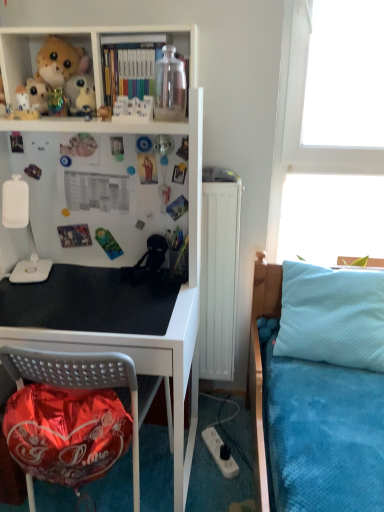
You are a GUI agent. You are given a task and a screenshot of the screen. Output one action in this format:
    pyautogui.click(x=<x>, y=<y>)
    Task: Click on the white plastic power outlet at lower center
    This screenshot has width=384, height=512.
    Given the screenshot: What is the action you would take?
    pyautogui.click(x=219, y=453)

Describe the element at coordinates (20, 228) in the screenshot. This screenshot has width=384, height=512. I see `white plastic lamp at left` at that location.

The height and width of the screenshot is (512, 384). Describe the element at coordinates (104, 112) in the screenshot. I see `matte plastic toy at upper center, placed as the first toy when sorted from front to back` at that location.

Describe the element at coordinates (96, 174) in the screenshot. I see `black matte desk at center` at that location.

What do you see at coordinates (170, 87) in the screenshot? The width and height of the screenshot is (384, 512). I see `transparent glass jar at upper center` at bounding box center [170, 87].

Describe the element at coordinates (116, 334) in the screenshot. The width and height of the screenshot is (384, 512). I see `metallic black desk at lower left` at that location.

The image size is (384, 512). I want to click on white plastic power outlet at lower center, so click(x=219, y=453).

Measure the distance from white plush toy at upper left, which ranks as the third toy in front-to-back order, to white plastic power outlet at lower center.

white plush toy at upper left, which ranks as the third toy in front-to-back order, and white plastic power outlet at lower center are 4.89 feet apart from each other.

From a real-world perspective, is white plush toy at upper left, which ranks as the third toy in front-to-back order, positioned above or below white plastic power outlet at lower center?

white plush toy at upper left, which ranks as the third toy in front-to-back order, is above white plastic power outlet at lower center.

Which is more to the left, white plush toy at upper left, placed as the 1th toy when sorted from left to right, or white plastic power outlet at lower center?

Positioned to the left is white plush toy at upper left, placed as the 1th toy when sorted from left to right.

Is white plush toy at upper left, acting as the 1th toy starting from the back, located outside white plastic power outlet at lower center?

Indeed, white plush toy at upper left, acting as the 1th toy starting from the back, is completely outside white plastic power outlet at lower center.

Is white plastic lamp at left inside the boundaries of transparent glass jar at upper center, or outside?

white plastic lamp at left lies outside transparent glass jar at upper center.

Considering the relative sizes of white plastic lamp at left and transparent glass jar at upper center in the image provided, is white plastic lamp at left smaller than transparent glass jar at upper center?

Actually, white plastic lamp at left might be larger than transparent glass jar at upper center.

From the image's perspective, is white plastic lamp at left beneath transparent glass jar at upper center?

Indeed, from the image's perspective, white plastic lamp at left is shown beneath transparent glass jar at upper center.

Identify the location of lamp below the transparent glass jar at upper center (from a real-world perspective). (20, 228).

Image resolution: width=384 pixels, height=512 pixels. In order to click on the 1st toy behind the light blue quilted pillow at right in this screenshot , I will do `click(24, 106)`.

From the image's perspective, is white matte plush toy at upper left, which is counted as the second toy, starting from the right, located above or below light blue quilted pillow at right?

Clearly, from the image's perspective, white matte plush toy at upper left, which is counted as the second toy, starting from the right, is above light blue quilted pillow at right.

From a real-world perspective, which object stands above the other?

white matte plush toy at upper left, which is counted as the second toy, starting from the back.

Is white matte plush toy at upper left, which is counted as the 2th toy, starting from the left, completely or partially outside of light blue quilted pillow at right?

Indeed, white matte plush toy at upper left, which is counted as the 2th toy, starting from the left, is completely outside light blue quilted pillow at right.

Can you see white plastic lamp at left touching transparent glass window at upper right?

white plastic lamp at left and transparent glass window at upper right are not in contact.

Is white plastic lamp at left oriented towards transparent glass window at upper right?

No, white plastic lamp at left is not turned towards transparent glass window at upper right.

Could transparent glass window at upper right be considered to be inside white plastic lamp at left?

No, transparent glass window at upper right is located outside of white plastic lamp at left.

From a real-world perspective, relative to transparent glass window at upper right, is white plastic lamp at left vertically above or below?

From a real-world perspective, white plastic lamp at left is physically below transparent glass window at upper right.

Looking at the image, does black matte desk at center seem bigger or smaller compared to fluffy brown teddy bear at upper left?

black matte desk at center is bigger than fluffy brown teddy bear at upper left.

Does black matte desk at center turn towards fluffy brown teddy bear at upper left?

No, black matte desk at center is not oriented towards fluffy brown teddy bear at upper left.

From a real-world perspective, is black matte desk at center under fluffy brown teddy bear at upper left?

Yes, from a real-world perspective, black matte desk at center is under fluffy brown teddy bear at upper left.

Which of these two, black matte desk at center or fluffy brown teddy bear at upper left, stands taller?

Standing taller between the two is black matte desk at center.

The image size is (384, 512). There is a fluffy brown teddy bear at upper left. Find the location of `the 3rd toy below it (from a real-world perspective)`. the 3rd toy below it (from a real-world perspective) is located at coordinates (104, 112).

From the image's perspective, which is above, matte plastic toy at upper center, which is the first toy from right to left, or fluffy brown teddy bear at upper left?

fluffy brown teddy bear at upper left.

From a real-world perspective, is matte plastic toy at upper center, which is the 3th toy from left to right, positioned over fluffy brown teddy bear at upper left based on gravity?

No, from a real-world perspective, matte plastic toy at upper center, which is the 3th toy from left to right, is not above fluffy brown teddy bear at upper left.

Is matte plastic toy at upper center, marked as the third toy in a back-to-front arrangement, directly adjacent to fluffy brown teddy bear at upper left?

matte plastic toy at upper center, marked as the third toy in a back-to-front arrangement, and fluffy brown teddy bear at upper left are clearly separated.

Is white matte plush toy at upper left, which is counted as the 2th toy, starting from the left, looking in the opposite direction of transparent glass window at upper right?

white matte plush toy at upper left, which is counted as the 2th toy, starting from the left, is not turned away from transparent glass window at upper right.

Considering the sizes of objects white matte plush toy at upper left, the 2th toy viewed from the front, and transparent glass window at upper right in the image provided, who is wider, white matte plush toy at upper left, the 2th toy viewed from the front, or transparent glass window at upper right?

transparent glass window at upper right.

Image resolution: width=384 pixels, height=512 pixels. Find the location of `power outlet below the white plush toy at upper left, acting as the 1th toy starting from the back (from a real-world perspective)`. power outlet below the white plush toy at upper left, acting as the 1th toy starting from the back (from a real-world perspective) is located at coordinates point(219,453).

Locate an element on the screen. This screenshot has height=512, width=384. bottle above the white plastic lamp at left (from a real-world perspective) is located at coordinates (170, 87).

Which object lies further to the anchor point black matte desk at center, matte plastic books at upper center or white plastic lamp at left?

matte plastic books at upper center is further to black matte desk at center.

Looking at this image, which object lies nearer to the anchor point light blue quilted pillow at right, metallic black desk at lower left or white plastic lamp at left?

metallic black desk at lower left is closer to light blue quilted pillow at right.

Looking at the image, which one is located closer to white matte plush toy at upper left, which is counted as the second toy, starting from the back, light blue quilted pillow at right or white plastic lamp at left?

Based on the image, white plastic lamp at left appears to be nearer to white matte plush toy at upper left, which is counted as the second toy, starting from the back.

Estimate the real-world distances between objects in this image. Which object is closer to black matte desk at center, matte plastic toy at upper center, marked as the third toy in a back-to-front arrangement, or fluffy brown teddy bear at upper left?

Among the two, fluffy brown teddy bear at upper left is located nearer to black matte desk at center.

Based on their spatial positions, is white matte plush toy at upper left, the 2th toy viewed from the front, or white plastic power outlet at lower center closer to white plush toy at upper left, which appears as the 3th toy when viewed from the right?

Based on the image, white matte plush toy at upper left, the 2th toy viewed from the front, appears to be nearer to white plush toy at upper left, which appears as the 3th toy when viewed from the right.

When comparing their distances from fluffy brown teddy bear at upper left, does light blue quilted pillow at right or matte plastic books at upper center seem further?

The object further to fluffy brown teddy bear at upper left is light blue quilted pillow at right.

Which object lies nearer to the anchor point white plastic power outlet at lower center, black matte desk at center or white plastic lamp at left?

The object closer to white plastic power outlet at lower center is white plastic lamp at left.

Which object lies nearer to the anchor point metallic black desk at lower left, white plastic lamp at left or matte plastic toy at upper center, marked as the third toy in a back-to-front arrangement?

Among the two, white plastic lamp at left is located nearer to metallic black desk at lower left.

This screenshot has width=384, height=512. I want to click on lamp between white matte plush toy at upper left, the 2th toy viewed from the front, and black matte desk at center, in the vertical direction, so click(20, 228).

In order to click on bottle between matte plastic toy at upper center, which is the 3th toy from left to right, and transparent glass window at upper right in this screenshot , I will do `click(170, 87)`.

What are the coordinates of `shelf between white plastic lamp at left and metallic black desk at lower left in the up-down direction` in the screenshot? It's located at (96, 174).

The image size is (384, 512). Find the location of `lamp between white matte plush toy at upper left, which is counted as the 2th toy, starting from the left, and white plastic power outlet at lower center, in the vertical direction`. lamp between white matte plush toy at upper left, which is counted as the 2th toy, starting from the left, and white plastic power outlet at lower center, in the vertical direction is located at coordinates (20, 228).